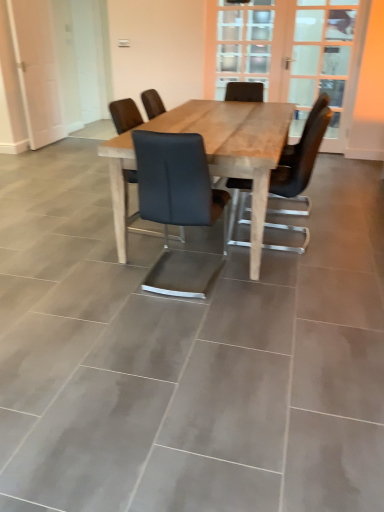
Question: Considering the positions of natural wood table at center and matte black chair at center, placed as the 1th chair when sorted from left to right, in the image, is natural wood table at center taller or shorter than matte black chair at center, placed as the 1th chair when sorted from left to right,?

Choices:
 (A) short
 (B) tall

Answer: (A)

Question: From the image's perspective, is natural wood table at center located above or below matte black chair at center, marked as the 3th chair in a right-to-left arrangement?

Choices:
 (A) below
 (B) above

Answer: (B)

Question: Which object is the closest to the natural wood table at center?

Choices:
 (A) clear glass door at upper center, positioned as the first screen door in right-to-left order
 (B) white glossy door at left, which appears as the second screen door when viewed from the right
 (C) black leather chair at center, acting as the 2th chair starting from the left
 (D) matte black chair at center, placed as the third chair when sorted from left to right
 (E) clear glass door at upper center

Answer: (D)

Question: Considering the real-world distances, which object is farthest from the matte black chair at center, the first chair viewed from the right?

Choices:
 (A) clear glass door at upper center, positioned as the first screen door in right-to-left order
 (B) white glossy door at left, which appears as the second screen door when viewed from the right
 (C) matte black chair at center, placed as the 1th chair when sorted from left to right
 (D) natural wood table at center
 (E) black leather chair at center, the second chair in the right-to-left sequence

Answer: (B)